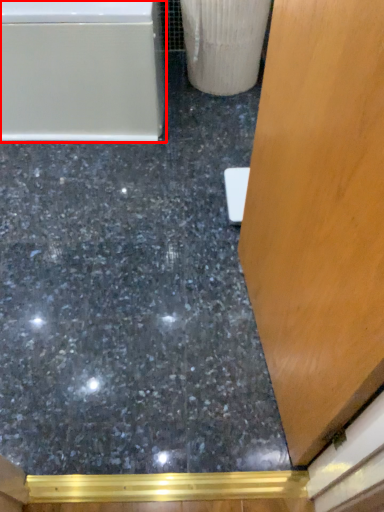
Question: In this image, where is bathtub (annotated by the red box) located relative to concrete?

Choices:
 (A) left
 (B) right

Answer: (A)